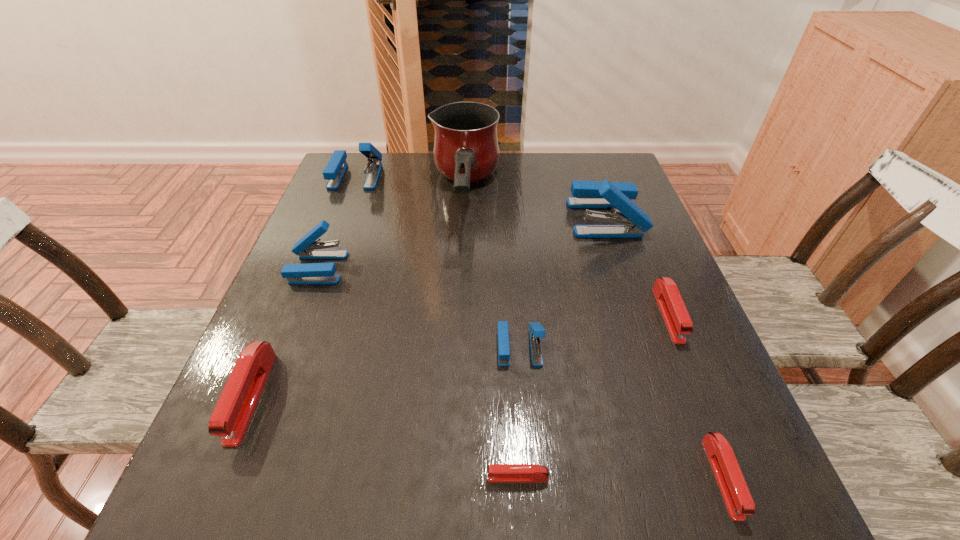
What are the coordinates of `the third smallest red stapler` in the screenshot? It's located at (679, 324).

This screenshot has width=960, height=540. Identify the location of the farthest red stapler. [x=679, y=324].

Locate an element on the screen. The width and height of the screenshot is (960, 540). the third biggest red stapler is located at coordinates (736, 495).

You are a GUI agent. You are given a task and a screenshot of the screen. Output one action in this format:
    pyautogui.click(x=<x>, y=<y>)
    Task: Click on the seventh tallest stapler
    The image size is (960, 540).
    Given the screenshot: What is the action you would take?
    pyautogui.click(x=736, y=495)

Where is `the shortest stapler`? the shortest stapler is located at coordinates (497, 473).

The width and height of the screenshot is (960, 540). What are the coordinates of `the shortest object` in the screenshot? It's located at (497, 473).

The width and height of the screenshot is (960, 540). Identify the location of free space located 0.390m on the handle side of the tallest object. (455, 407).

Identify the location of free space located on the left of the eighth shortest object. (414, 218).

Find the location of a particular element. vacant region located 0.100m on the front of the third smallest blue stapler is located at coordinates (342, 212).

The image size is (960, 540). What are the coordinates of `free space located on the back of the sixth shortest stapler` in the screenshot? It's located at (329, 236).